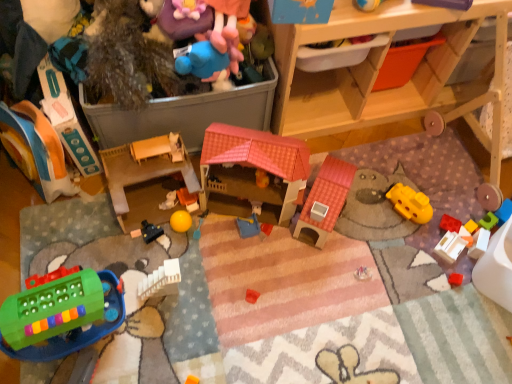
Where is `vacant region to the left of white matte block at lower right, which is the 12th toy in left-to-right order`? This screenshot has width=512, height=384. vacant region to the left of white matte block at lower right, which is the 12th toy in left-to-right order is located at coordinates (423, 249).